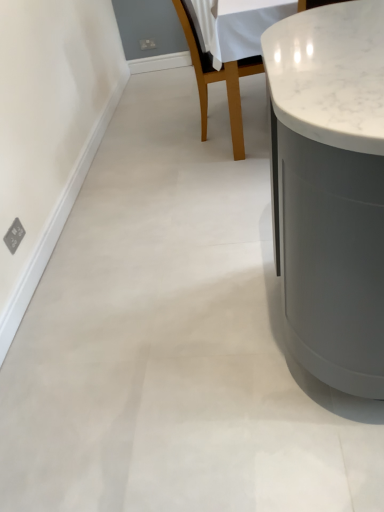
What do you see at coordinates (218, 79) in the screenshot? I see `wooden chair at center` at bounding box center [218, 79].

Find the location of `wooden chair at center`. wooden chair at center is located at coordinates (218, 79).

Measure the distance between white marble countertop at upper right and camera.

The depth of white marble countertop at upper right is 24.72 inches.

This screenshot has height=512, width=384. Describe the element at coordinates (330, 74) in the screenshot. I see `white marble countertop at upper right` at that location.

You are a GUI agent. You are given a task and a screenshot of the screen. Output one action in this format:
    pyautogui.click(x=<x>, y=<y>)
    Task: Click on the white marble countertop at upper right
    
    Given the screenshot: What is the action you would take?
    pyautogui.click(x=330, y=74)

Locate an element on the screen. This screenshot has height=512, width=384. wooden chair at center is located at coordinates (218, 79).

Is white marble countertop at upper right to the left or to the right of wooden chair at center in the image?

Clearly, white marble countertop at upper right is on the right of wooden chair at center in the image.

In the scene shown: Does white marble countertop at upper right lie behind wooden chair at center?

No, it is not.

Is point (380, 53) closer to camera compared to point (195, 41)?

Yes, point (380, 53) is closer to viewer.

From the image's perspective, is white marble countertop at upper right over wooden chair at center?

Correct, white marble countertop at upper right appears higher than wooden chair at center in the image.

From a real-world perspective, is white marble countertop at upper right on wooden chair at center?

No, from a real-world perspective, white marble countertop at upper right is not over wooden chair at center

Is white marble countertop at upper right wider than wooden chair at center?

Correct, the width of white marble countertop at upper right exceeds that of wooden chair at center.

Between white marble countertop at upper right and wooden chair at center, which one has less height?

With less height is white marble countertop at upper right.

Considering the relative sizes of white marble countertop at upper right and wooden chair at center in the image provided, is white marble countertop at upper right bigger than wooden chair at center?

Correct, white marble countertop at upper right is larger in size than wooden chair at center.

Could wooden chair at center be considered to be inside white marble countertop at upper right?

Indeed, wooden chair at center is located within white marble countertop at upper right.

Is the surface of white marble countertop at upper right in direct contact with wooden chair at center?

No, white marble countertop at upper right is not making contact with wooden chair at center.

Does white marble countertop at upper right turn towards wooden chair at center?

No, white marble countertop at upper right is not turned towards wooden chair at center.

Looking at this image, how many degrees apart are the facing directions of white marble countertop at upper right and wooden chair at center?

white marble countertop at upper right and wooden chair at center are facing 92.9 degrees away from each other.

At what (x,y) coordinates should I click in order to perform the action: click on chair below the white marble countertop at upper right (from the image's perspective). Please return your answer as a coordinate pair (x, y). This screenshot has height=512, width=384. Looking at the image, I should click on pyautogui.click(x=218, y=79).

Is wooden chair at center to the right of white marble countertop at upper right from the viewer's perspective?

No, wooden chair at center is not to the right of white marble countertop at upper right.

Is the position of wooden chair at center more distant than that of white marble countertop at upper right?

Yes, wooden chair at center is behind white marble countertop at upper right.

Is point (235, 70) more distant than point (367, 110)?

Yes, it is.

From the image's perspective, which object appears higher, wooden chair at center or white marble countertop at upper right?

white marble countertop at upper right, from the image's perspective.

Looking at this image, from a real-world perspective, is wooden chair at center on top of white marble countertop at upper right?

Yes, from a real-world perspective, wooden chair at center is on top of white marble countertop at upper right.

Can you confirm if wooden chair at center is thinner than white marble countertop at upper right?

Indeed, wooden chair at center has a lesser width compared to white marble countertop at upper right.

Can you confirm if wooden chair at center is taller than white marble countertop at upper right?

Correct, wooden chair at center is much taller as white marble countertop at upper right.

Is wooden chair at center bigger than white marble countertop at upper right?

No, wooden chair at center is not bigger than white marble countertop at upper right.

Can we say wooden chair at center lies outside white marble countertop at upper right?

No, wooden chair at center is inside white marble countertop at upper right's boundary.

Is wooden chair at center not near white marble countertop at upper right?

Yes.

Is wooden chair at center aimed at white marble countertop at upper right?

Yes, wooden chair at center faces towards white marble countertop at upper right.

What's the angular difference between wooden chair at center and white marble countertop at upper right's facing directions?

wooden chair at center and white marble countertop at upper right are facing 92.9 degrees away from each other.

How far apart are wooden chair at center and white marble countertop at upper right?

wooden chair at center and white marble countertop at upper right are 1.33 meters apart.

Where is `chair that appears behind the white marble countertop at upper right`? chair that appears behind the white marble countertop at upper right is located at coordinates (218, 79).

Locate an element on the screen. Image resolution: width=384 pixels, height=512 pixels. counter top that appears on the right of wooden chair at center is located at coordinates (330, 74).

Find the location of a particular element. The height and width of the screenshot is (512, 384). counter top lying above the wooden chair at center (from the image's perspective) is located at coordinates (330, 74).